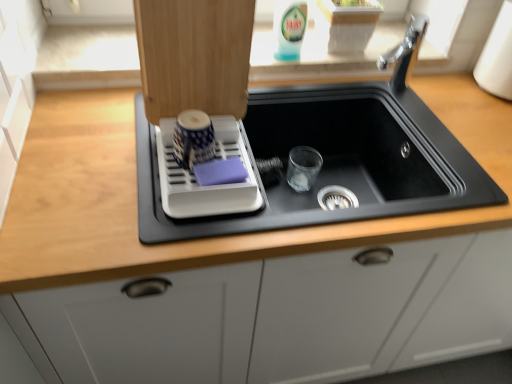
What is the approximate height of white plastic dish rack at upper left?

The height of white plastic dish rack at upper left is 5.99 inches.

Describe the element at coordinates (331, 160) in the screenshot. I see `black matte sink at center` at that location.

What do you see at coordinates (289, 28) in the screenshot? This screenshot has width=512, height=384. I see `translucent plastic bottle at upper center` at bounding box center [289, 28].

Where is `white plastic dish rack at upper left`? The height and width of the screenshot is (384, 512). white plastic dish rack at upper left is located at coordinates (196, 179).

From the image's perspective, would you say white plastic dish rack at upper left is positioned over black matte sink at center?

Yes, from the image's perspective, white plastic dish rack at upper left is over black matte sink at center.

Is white plastic dish rack at upper left next to black matte sink at center?

No, white plastic dish rack at upper left is not next to black matte sink at center.

Is point (194, 206) farther from viewer compared to point (424, 205)?

No, it is not.

Considering the sizes of objects white plastic dish rack at upper left and black matte sink at center in the image provided, who is taller, white plastic dish rack at upper left or black matte sink at center?

black matte sink at center is taller.

Is white plastic dish rack at upper left located within translucent plastic bottle at upper center?

No, white plastic dish rack at upper left is not surrounded by translucent plastic bottle at upper center.

Considering the sizes of translucent plastic bottle at upper center and white plastic dish rack at upper left in the image, is translucent plastic bottle at upper center taller or shorter than white plastic dish rack at upper left?

Clearly, translucent plastic bottle at upper center is taller compared to white plastic dish rack at upper left.

From the image's perspective, does translucent plastic bottle at upper center appear lower than white plastic dish rack at upper left?

No, from the image's perspective, translucent plastic bottle at upper center is not below white plastic dish rack at upper left.

Between translucent plastic bottle at upper center and white plastic dish rack at upper left, which one has larger size?

Bigger between the two is white plastic dish rack at upper left.

How many degrees apart are the facing directions of translucent plastic bottle at upper center and black matte sink at center?

The angular difference between translucent plastic bottle at upper center and black matte sink at center is 1.93 degrees.

Does translucent plastic bottle at upper center have a smaller size compared to black matte sink at center?

Yes.

Considering the sizes of objects translucent plastic bottle at upper center and black matte sink at center in the image provided, who is taller, translucent plastic bottle at upper center or black matte sink at center?

Standing taller between the two is black matte sink at center.

Is translucent plastic bottle at upper center looking in the opposite direction of black matte sink at center?

No, translucent plastic bottle at upper center is not facing the opposite direction of black matte sink at center.

Which of these two, white plastic dish rack at upper left or translucent plastic bottle at upper center, is thinner?

Thinner between the two is translucent plastic bottle at upper center.

What's the angular difference between white plastic dish rack at upper left and translucent plastic bottle at upper center's facing directions?

1.89 degrees separate the facing orientations of white plastic dish rack at upper left and translucent plastic bottle at upper center.

Is translucent plastic bottle at upper center at the back of white plastic dish rack at upper left?

That's not correct — white plastic dish rack at upper left is not looking away from translucent plastic bottle at upper center.

Are white plastic dish rack at upper left and translucent plastic bottle at upper center making contact?

They are not placed beside each other.

From a real-world perspective, is black matte sink at center under white plastic dish rack at upper left?

Yes.

Locate an element on the screen. The height and width of the screenshot is (384, 512). sink below the white plastic dish rack at upper left (from a real-world perspective) is located at coordinates (331, 160).

Can you confirm if black matte sink at center is wider than white plastic dish rack at upper left?

Correct, the width of black matte sink at center exceeds that of white plastic dish rack at upper left.

Is black matte sink at center touching white plastic dish rack at upper left?

There is a gap between black matte sink at center and white plastic dish rack at upper left.

Where is `sink in front of the translucent plastic bottle at upper center`? The image size is (512, 384). sink in front of the translucent plastic bottle at upper center is located at coordinates (331, 160).

Does black matte sink at center lie in front of translucent plastic bottle at upper center?

Yes.

In terms of size, does black matte sink at center appear bigger or smaller than translucent plastic bottle at upper center?

In the image, black matte sink at center appears to be larger than translucent plastic bottle at upper center.

Considering the positions of objects black matte sink at center and translucent plastic bottle at upper center in the image provided, who is more to the right, black matte sink at center or translucent plastic bottle at upper center?

Positioned to the right is black matte sink at center.

You are a GUI agent. You are given a task and a screenshot of the screen. Output one action in this format:
    pyautogui.click(x=<x>, y=<y>)
    Task: Click on the appliance in front of the black matte sink at center
    
    Given the screenshot: What is the action you would take?
    pyautogui.click(x=196, y=179)

This screenshot has width=512, height=384. I want to click on beverage that is above the white plastic dish rack at upper left (from the image's perspective), so click(x=289, y=28).

When comparing their distances from white plastic dish rack at upper left, does translucent plastic bottle at upper center or black matte sink at center seem further?

translucent plastic bottle at upper center is positioned further to the anchor white plastic dish rack at upper left.

In the scene shown: Which object lies nearer to the anchor point black matte sink at center, translucent plastic bottle at upper center or white plastic dish rack at upper left?

white plastic dish rack at upper left is closer to black matte sink at center.

From the image, which object appears to be farther from black matte sink at center, white plastic dish rack at upper left or translucent plastic bottle at upper center?

Among the two, translucent plastic bottle at upper center is located further to black matte sink at center.

Looking at the image, which one is located further to translucent plastic bottle at upper center, black matte sink at center or white plastic dish rack at upper left?

The object further to translucent plastic bottle at upper center is white plastic dish rack at upper left.

Based on their spatial positions, is white plastic dish rack at upper left or black matte sink at center closer to translucent plastic bottle at upper center?

Based on the image, black matte sink at center appears to be nearer to translucent plastic bottle at upper center.

Estimate the real-world distances between objects in this image. Which object is further from white plastic dish rack at upper left, black matte sink at center or translucent plastic bottle at upper center?

The object further to white plastic dish rack at upper left is translucent plastic bottle at upper center.

Where is `appliance that lies between translucent plastic bottle at upper center and black matte sink at center from top to bottom`? The image size is (512, 384). appliance that lies between translucent plastic bottle at upper center and black matte sink at center from top to bottom is located at coordinates (196, 179).